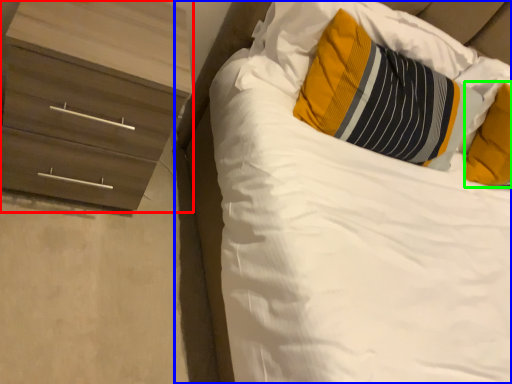
Question: Which object is positioned closest to chest of drawers (highlighted by a red box)? Select from bed (highlighted by a blue box) and pillow (highlighted by a green box).

Choices:
 (A) bed
 (B) pillow

Answer: (A)